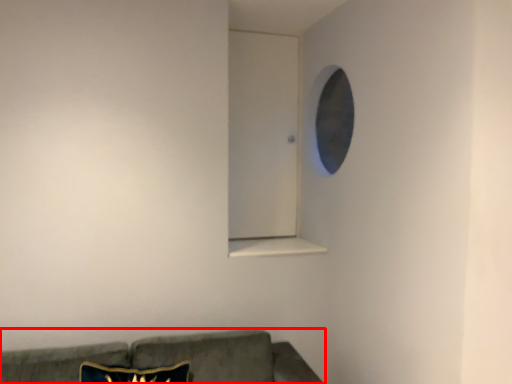
Question: From the image, what is the correct spatial relationship of studio couch (annotated by the red box) in relation to window sill?

Choices:
 (A) left
 (B) right

Answer: (A)